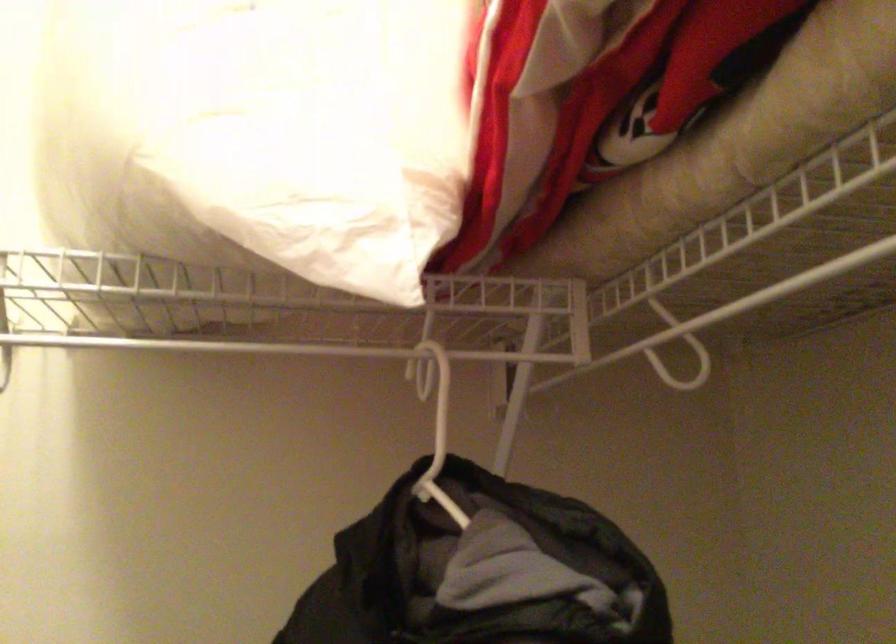
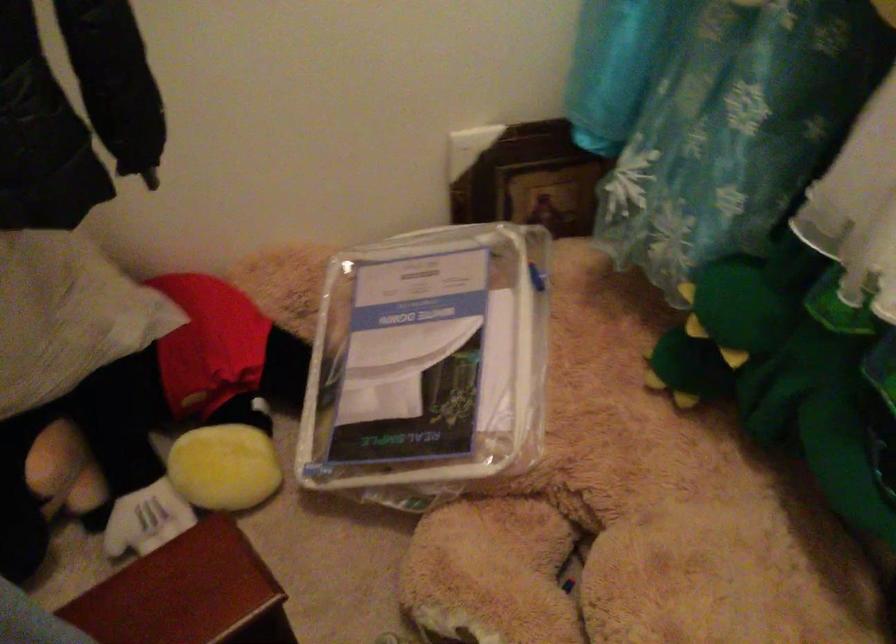
The first image is from the beginning of the video and the second image is from the end. How did the camera likely rotate when shooting the video?

The rotation direction of the camera is right-down.